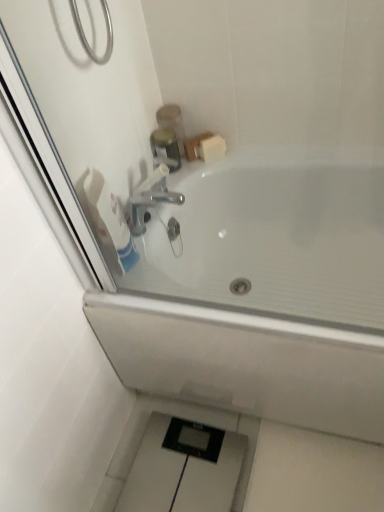
Question: Does white matte soap at upper right come in front of brushed metal soap dispenser at upper center?

Choices:
 (A) yes
 (B) no

Answer: (B)

Question: Is white matte soap at upper right positioned behind brushed metal soap dispenser at upper center?

Choices:
 (A) yes
 (B) no

Answer: (A)

Question: Is white matte soap at upper right thinner than brushed metal soap dispenser at upper center?

Choices:
 (A) no
 (B) yes

Answer: (B)

Question: Can you confirm if white matte soap at upper right is positioned to the right of brushed metal soap dispenser at upper center?

Choices:
 (A) no
 (B) yes

Answer: (B)

Question: Can you confirm if white matte soap at upper right is taller than brushed metal soap dispenser at upper center?

Choices:
 (A) no
 (B) yes

Answer: (A)

Question: From the image's perspective, is white glossy bathtub at upper center positioned above or below white matte toilet paper at upper left?

Choices:
 (A) above
 (B) below

Answer: (B)

Question: Visually, is white glossy bathtub at upper center positioned to the left or to the right of white matte toilet paper at upper left?

Choices:
 (A) left
 (B) right

Answer: (B)

Question: Considering the positions of white glossy bathtub at upper center and white matte toilet paper at upper left in the image, is white glossy bathtub at upper center wider or thinner than white matte toilet paper at upper left?

Choices:
 (A) thin
 (B) wide

Answer: (B)

Question: Would you say white glossy bathtub at upper center is inside or outside white matte toilet paper at upper left?

Choices:
 (A) inside
 (B) outside

Answer: (B)

Question: In terms of size, does white glossy bathtub at upper center appear bigger or smaller than white matte soap at upper right?

Choices:
 (A) big
 (B) small

Answer: (A)

Question: Considering the positions of white glossy bathtub at upper center and white matte soap at upper right in the image, is white glossy bathtub at upper center taller or shorter than white matte soap at upper right?

Choices:
 (A) short
 (B) tall

Answer: (B)

Question: Visually, is white glossy bathtub at upper center positioned to the left or to the right of white matte soap at upper right?

Choices:
 (A) left
 (B) right

Answer: (B)

Question: From a real-world perspective, is white glossy bathtub at upper center above or below white matte soap at upper right?

Choices:
 (A) above
 (B) below

Answer: (B)

Question: Choose the correct answer: Is brushed metal soap dispenser at upper center inside white matte soap at upper right or outside it?

Choices:
 (A) outside
 (B) inside

Answer: (A)

Question: Considering the positions of brushed metal soap dispenser at upper center and white matte soap at upper right in the image, is brushed metal soap dispenser at upper center bigger or smaller than white matte soap at upper right?

Choices:
 (A) small
 (B) big

Answer: (B)